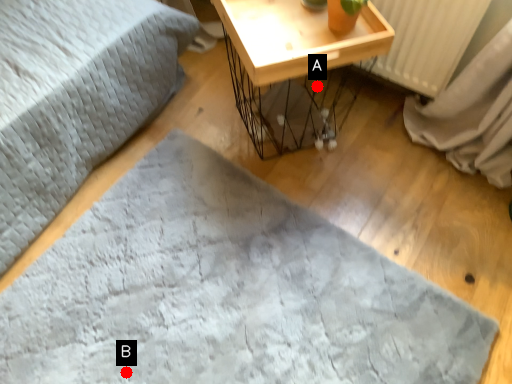
Question: Two points are circled on the image, labeled by A and B beside each circle. Which of the following is the closest to the observer?

Choices:
 (A) A is closer
 (B) B is closer

Answer: (B)